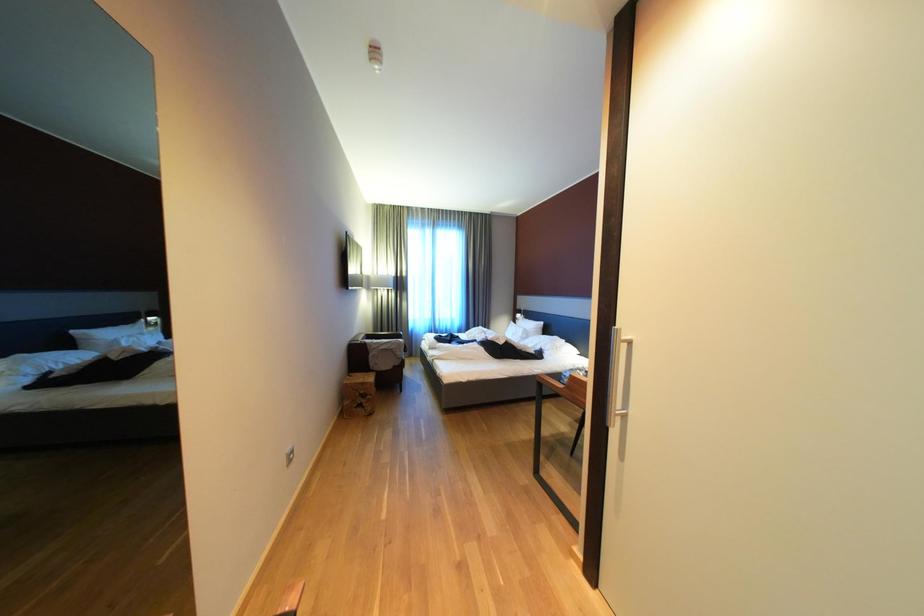
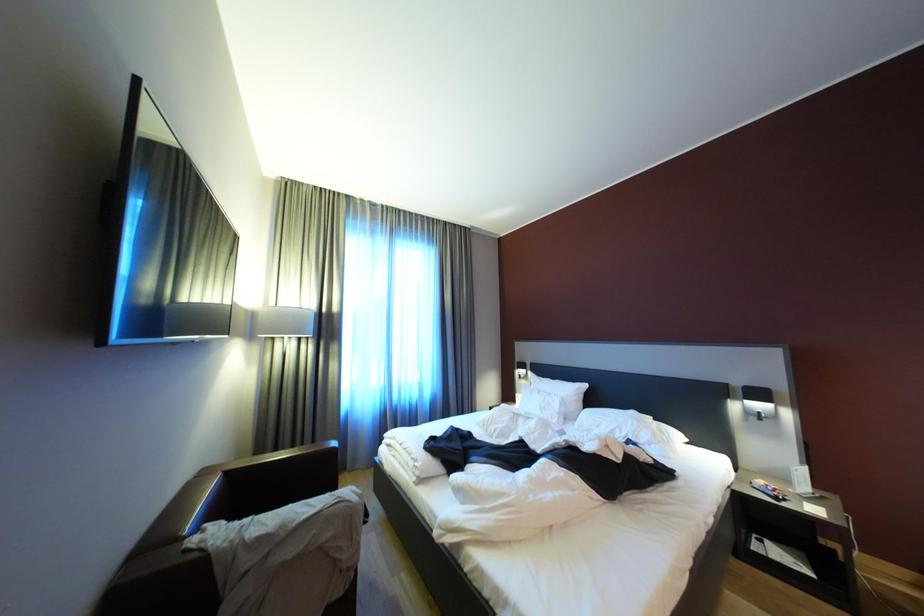
What movement of the cameraman would produce the second image?

The cameraman moved toward left, forward.